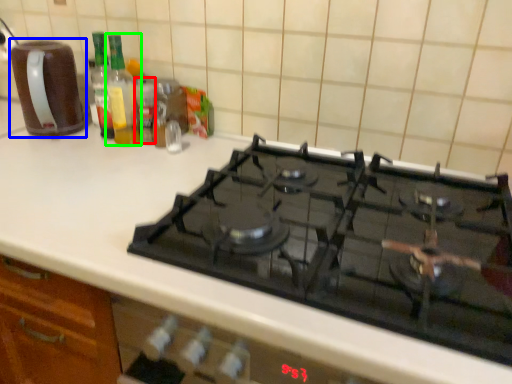
Question: Which is nearer to the bottle (highlighted by a red box)? kitchen appliance (highlighted by a blue box) or bottle (highlighted by a green box).

Choices:
 (A) kitchen appliance
 (B) bottle

Answer: (B)